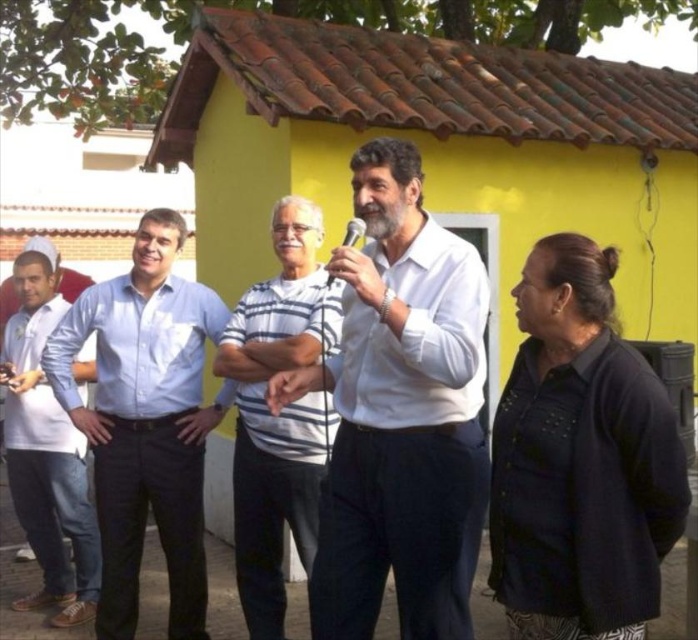
You are a photographer trying to capture a group photo of the light blue shirt at center and the white shirt at left. The camera you are using has a minimum focus distance of 25 inches. Can you take a clear photo of both subjects without moving them?

The light blue shirt at center and white shirt at left are 26.31 inches apart from each other. Since this distance is greater than the camera minimum focus distance of 25 inches, you can take a clear photo of both subjects without moving them.

You are a photographer trying to capture a clear shot of both the white matte shirt at center and the light blue shirt at center. Based on their positions, which shirt should you focus on first to ensure both are in frame?

The white matte shirt at center is located above the light blue shirt at center, so you should focus on the white matte shirt at center first to ensure both are in frame.

You are organizing a group photo and need to arrange the people so that the light blue shirt at center and the gray striped shirt at center can stand side by side. Given their sizes, which one should be placed on the left to ensure they fit comfortably in the frame?

The light blue shirt at center has a larger width than the gray striped shirt at center, so placing the light blue shirt at center on the left would allow both to fit comfortably in the frame since it requires more space.